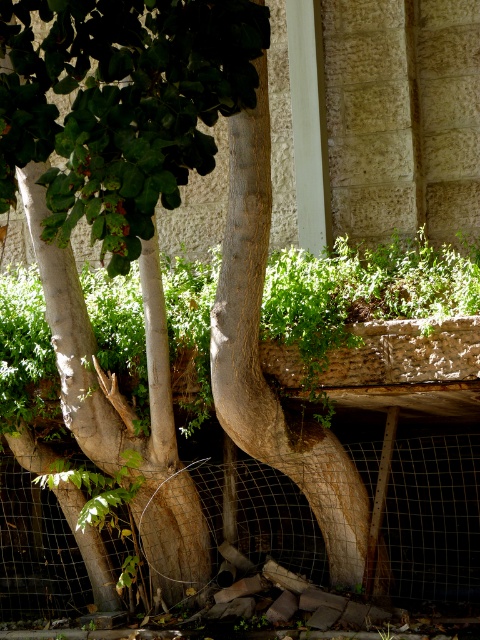
You are standing in a park and see a large tree with a thick trunk curving to the right. There is a point marked at coordinates [360,296]. What is located at that point?

The point at coordinates [360,296] marks a green leafy plant at center.

In the scene shown: You are a gardener assessing the space between the green leafy plant at center and the brown rough bark at center. Can you fit a 20cm wide gardening tool between them?

The green leafy plant at center is wider than the brown rough bark at center. Since the tool is 20cm wide, you need to check the available space between them. However, the description only states the width comparison between the two objects but does not provide exact measurements. Therefore, it is uncertain whether the tool will fit without additional information.